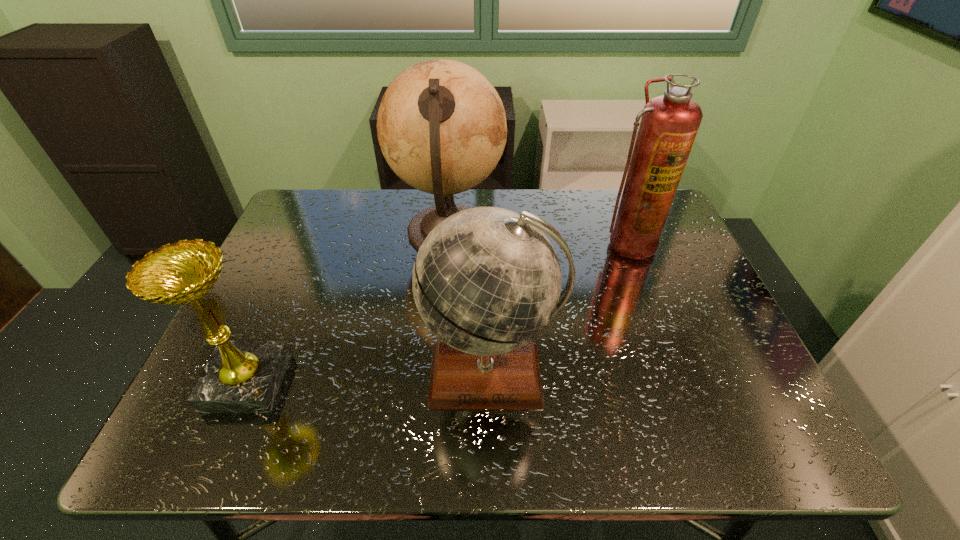
The height and width of the screenshot is (540, 960). What are the coordinates of `vacant space at the far right corner of the desktop` in the screenshot? It's located at (618, 191).

I want to click on vacant space that's between the shortest object and the farther globe, so click(348, 307).

In order to click on free space between the award and the farther globe in this screenshot , I will do `click(348, 307)`.

Where is `vacant area between the nearer globe and the award`? The width and height of the screenshot is (960, 540). vacant area between the nearer globe and the award is located at coordinates pos(369,379).

This screenshot has width=960, height=540. Find the location of `object that is the nearest to the award`. object that is the nearest to the award is located at coordinates (441, 125).

This screenshot has width=960, height=540. What are the coordinates of `object that stands as the third closest to the nearer globe` in the screenshot? It's located at (241, 376).

The height and width of the screenshot is (540, 960). I want to click on vacant space that satisfies the following two spatial constraints: 1. at the equator of the nearer globe; 2. on the front-facing side of the shortest object, so click(491, 382).